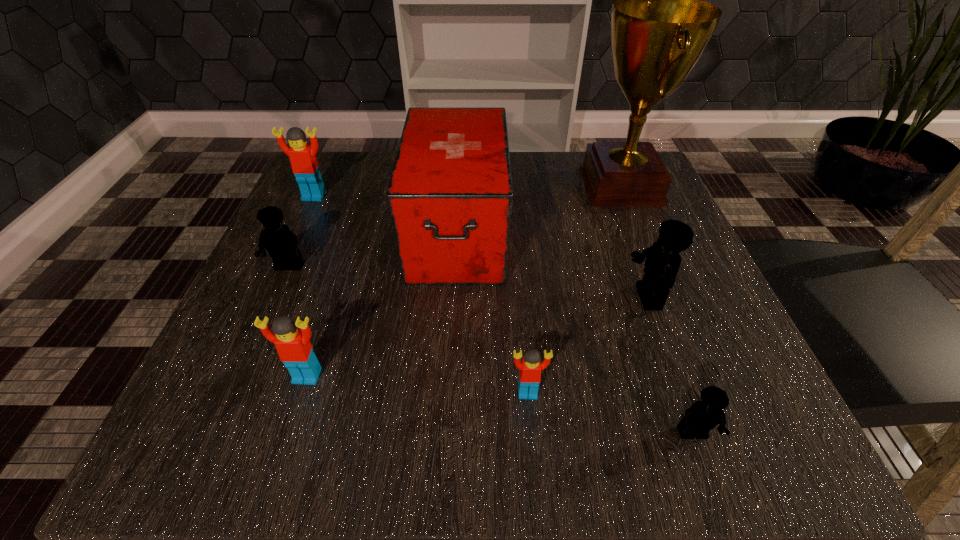
This screenshot has width=960, height=540. Find the location of `red Lego that stands as the third closest to the nearest object`. red Lego that stands as the third closest to the nearest object is located at coordinates (305, 167).

Point out which red Lego is positioned as the second nearest to the seventh shortest object. Please provide its 2D coordinates. Your answer should be formatted as a tuple, i.e. [(x, y)], where the tuple contains the x and y coordinates of a point satisfying the conditions above.

[(305, 167)]

Image resolution: width=960 pixels, height=540 pixels. Find the location of `the second closest yellow Lego to the leftmost yellow Lego`. the second closest yellow Lego to the leftmost yellow Lego is located at coordinates (702, 416).

Identify which yellow Lego is located as the second nearest to the award. Please provide its 2D coordinates. Your answer should be formatted as a tuple, i.e. [(x, y)], where the tuple contains the x and y coordinates of a point satisfying the conditions above.

[(702, 416)]

Image resolution: width=960 pixels, height=540 pixels. What are the coordinates of `free space that satisfies the following two spatial constraints: 1. on the front-facing side of the fourth nearest Lego; 2. on the front-facing side of the nearest Lego` in the screenshot? It's located at (696, 434).

I want to click on free space that satisfies the following two spatial constraints: 1. on the front-facing side of the fourth nearest Lego; 2. on the face of the fifth farthest Lego, so click(x=682, y=393).

Identify the location of vacant space that satisfies the following two spatial constraints: 1. on the front-facing side of the second farthest yellow Lego; 2. on the front-facing side of the nearest object. (696, 434).

This screenshot has width=960, height=540. I want to click on vacant space that satisfies the following two spatial constraints: 1. on the front-facing side of the biggest yellow Lego; 2. on the front-facing side of the nearest object, so (x=696, y=434).